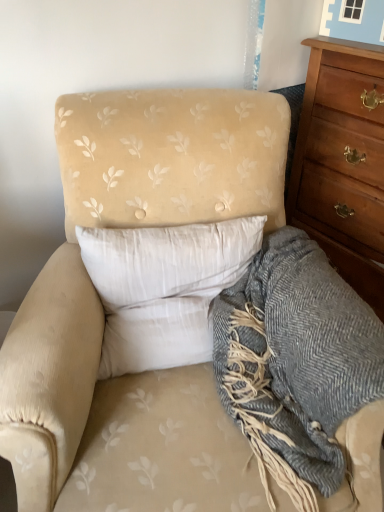
Question: From the image's perspective, would you say white soft pillow at center is positioned over wooden chest of drawers at right?

Choices:
 (A) no
 (B) yes

Answer: (A)

Question: Is white soft pillow at center not inside wooden chest of drawers at right?

Choices:
 (A) yes
 (B) no

Answer: (A)

Question: Can you confirm if white soft pillow at center is smaller than wooden chest of drawers at right?

Choices:
 (A) no
 (B) yes

Answer: (B)

Question: From a real-world perspective, is white soft pillow at center under wooden chest of drawers at right?

Choices:
 (A) no
 (B) yes

Answer: (A)

Question: Does white soft pillow at center have a larger size compared to wooden chest of drawers at right?

Choices:
 (A) no
 (B) yes

Answer: (A)

Question: From a real-world perspective, is white soft pillow at center located higher than wooden chest of drawers at right?

Choices:
 (A) no
 (B) yes

Answer: (B)

Question: Does gray woolen blanket at lower right have a greater width compared to white soft pillow at center?

Choices:
 (A) yes
 (B) no

Answer: (A)

Question: Is gray woolen blanket at lower right aimed at white soft pillow at center?

Choices:
 (A) no
 (B) yes

Answer: (A)

Question: Can you confirm if gray woolen blanket at lower right is shorter than white soft pillow at center?

Choices:
 (A) no
 (B) yes

Answer: (A)

Question: Is gray woolen blanket at lower right looking in the opposite direction of white soft pillow at center?

Choices:
 (A) yes
 (B) no

Answer: (B)

Question: Can you confirm if gray woolen blanket at lower right is taller than white soft pillow at center?

Choices:
 (A) yes
 (B) no

Answer: (A)

Question: Would you say gray woolen blanket at lower right is outside white soft pillow at center?

Choices:
 (A) yes
 (B) no

Answer: (A)

Question: Is wooden chest of drawers at right not within gray woolen blanket at lower right?

Choices:
 (A) yes
 (B) no

Answer: (A)